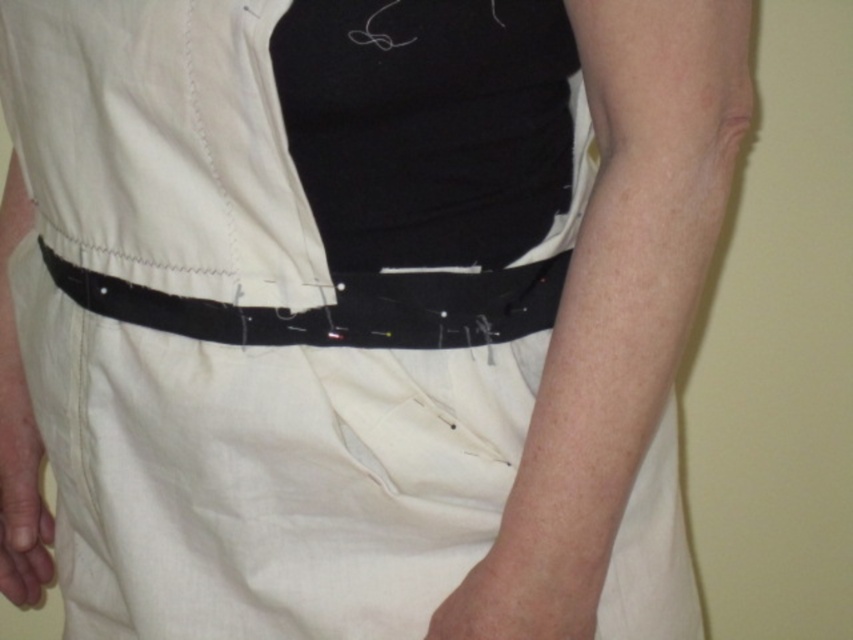
Question: Can you confirm if matte white shirt at center is thinner than smooth skin at lower center?

Choices:
 (A) yes
 (B) no

Answer: (B)

Question: Which of the following is the farthest from the observer?

Choices:
 (A) (498, 576)
 (B) (0, 508)

Answer: (B)

Question: Does matte white shirt at center have a larger size compared to smooth skin at lower center?

Choices:
 (A) no
 (B) yes

Answer: (B)

Question: Is matte white shirt at center wider than smooth beige hand at lower left?

Choices:
 (A) yes
 (B) no

Answer: (A)

Question: Which of the following is the closest to the observer?

Choices:
 (A) matte white shirt at center
 (B) black fabric belt at center
 (C) smooth beige hand at lower left

Answer: (A)

Question: Among these points, which one is nearest to the camera?

Choices:
 (A) (479, 611)
 (B) (248, 195)
 (C) (514, 298)

Answer: (A)